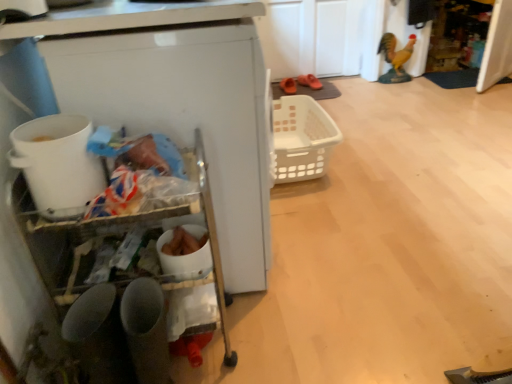
Identify the location of free space above white plastic bucket at left (from a real-world perspective). This screenshot has height=384, width=512. (51, 135).